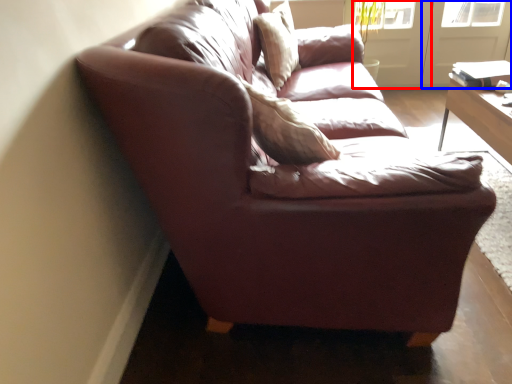
Question: Among these objects, which one is nearest to the camera, screen door (highlighted by a red box) or screen door (highlighted by a blue box)?

Choices:
 (A) screen door
 (B) screen door

Answer: (B)